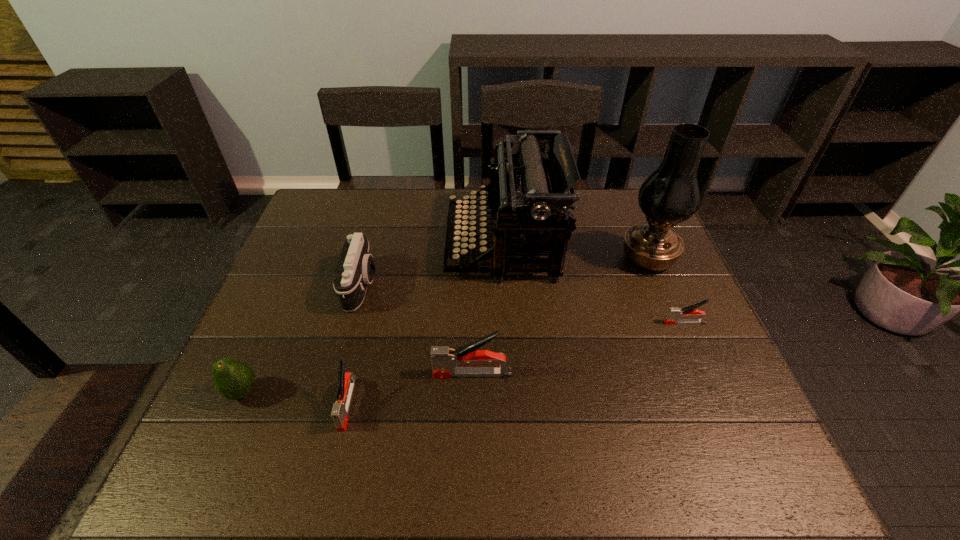
Locate an element on the screen. The width and height of the screenshot is (960, 540). vacant area that lies between the avocado and the camera is located at coordinates (302, 339).

This screenshot has width=960, height=540. Find the location of `object that can be found as the third closest to the oil lamp`. object that can be found as the third closest to the oil lamp is located at coordinates (444, 360).

Select which object is the fourth closest to the camera. Please provide its 2D coordinates. Your answer should be formatted as a tuple, i.e. [(x, y)], where the tuple contains the x and y coordinates of a point satisfying the conditions above.

[(444, 360)]

Where is `stapler object that ranks as the third closest to the oil lamp`? This screenshot has width=960, height=540. stapler object that ranks as the third closest to the oil lamp is located at coordinates (346, 381).

What are the coordinates of `stapler that is the closest one to the avocado` in the screenshot? It's located at pyautogui.click(x=346, y=381).

In order to click on free point that satisfies the following two spatial constraints: 1. on the typing side of the sixth shortest object; 2. on the handle side of the leftmost stapler in this screenshot , I will do `click(513, 404)`.

The height and width of the screenshot is (540, 960). What are the coordinates of `free region that satisfies the following two spatial constraints: 1. on the back side of the tallest object; 2. on the typing side of the sixth shortest object` in the screenshot? It's located at (642, 245).

Find the location of `vacant area in the image that satisfies the following two spatial constraints: 1. on the front side of the tallest object; 2. on the handle side of the tallest stapler`. vacant area in the image that satisfies the following two spatial constraints: 1. on the front side of the tallest object; 2. on the handle side of the tallest stapler is located at coordinates (695, 374).

The width and height of the screenshot is (960, 540). Find the location of `vacant area that satisfies the following two spatial constraints: 1. on the typing side of the typewriter; 2. on the handle side of the second tallest stapler`. vacant area that satisfies the following two spatial constraints: 1. on the typing side of the typewriter; 2. on the handle side of the second tallest stapler is located at coordinates (513, 404).

Identify the location of vacant area that satisfies the following two spatial constraints: 1. on the typing side of the sixth shortest object; 2. on the handle side of the second shortest stapler. The height and width of the screenshot is (540, 960). (513, 404).